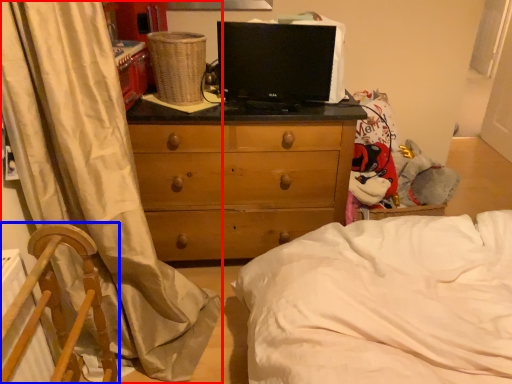
Question: Which of the following is the closest to the observer, curtain (highlighted by a red box) or furniture (highlighted by a blue box)?

Choices:
 (A) curtain
 (B) furniture

Answer: (B)